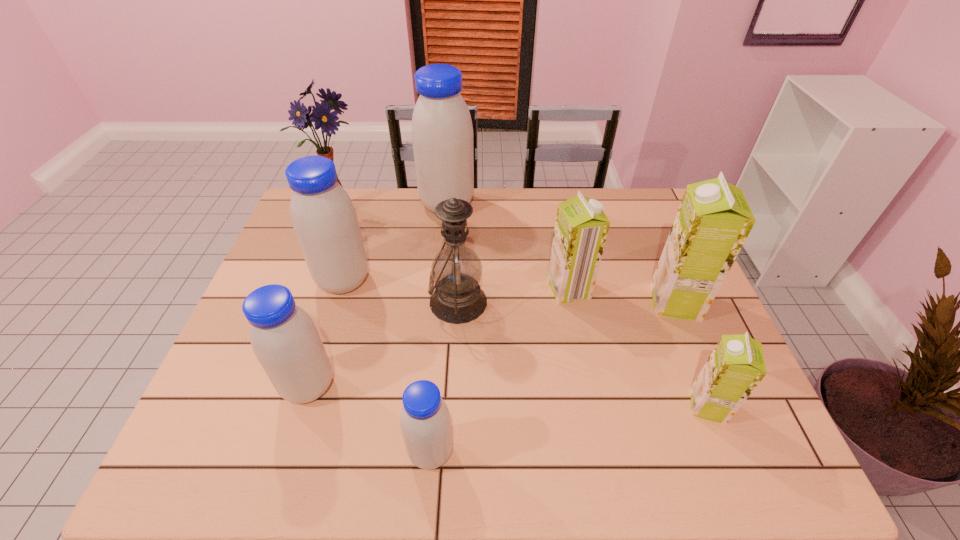
I want to click on vacant area that satisfies the following two spatial constraints: 1. on the back side of the biggest green soya milk; 2. on the left side of the nearest soya milk, so click(x=443, y=302).

I want to click on vacant space that satisfies the following two spatial constraints: 1. on the front side of the biggest green soya milk; 2. on the right side of the gray oil lamp, so click(x=458, y=302).